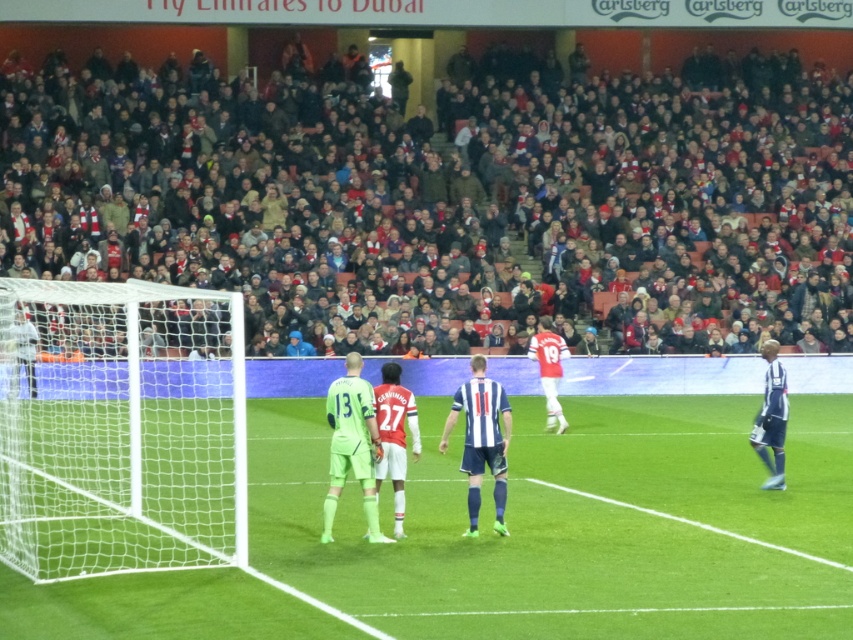
Is point (479, 433) less distant than point (763, 413)?

Yes, it is in front of point (763, 413).

Between striped jersey at center and blue jersey at right, which one has less height?

striped jersey at center is shorter.

What do you see at coordinates (480, 440) in the screenshot? I see `striped jersey at center` at bounding box center [480, 440].

Locate an element on the screen. Image resolution: width=853 pixels, height=640 pixels. striped jersey at center is located at coordinates (480, 440).

Is point (358, 390) in front of point (772, 488)?

Yes, it is in front of point (772, 488).

How distant is neon green jersey at center from blue jersey at right?

neon green jersey at center and blue jersey at right are 6.58 meters apart from each other.

Is point (364, 401) closer to viewer compared to point (761, 346)?

Yes, it is in front of point (761, 346).

This screenshot has width=853, height=640. Identify the location of neon green jersey at center. (352, 444).

What do you see at coordinates (433, 186) in the screenshot? The height and width of the screenshot is (640, 853). I see `dark brown leather seats at upper center` at bounding box center [433, 186].

Is the position of dark brown leather seats at upper center more distant than that of white mesh net at left?

Yes.

The image size is (853, 640). What are the coordinates of `dark brown leather seats at upper center` in the screenshot? It's located at (433, 186).

The image size is (853, 640). I want to click on dark brown leather seats at upper center, so click(x=433, y=186).